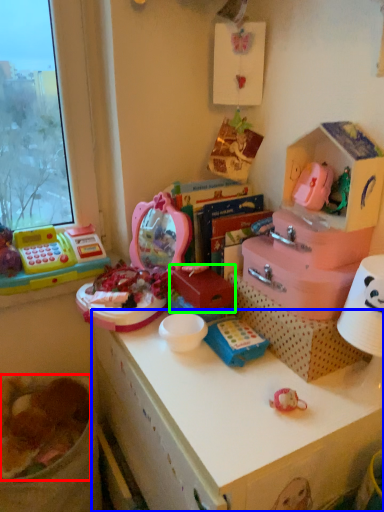
Question: Which object is positioned closest to food (highlighted by a red box)? Select from desk (highlighted by a blue box) and box (highlighted by a green box).

Choices:
 (A) desk
 (B) box

Answer: (A)